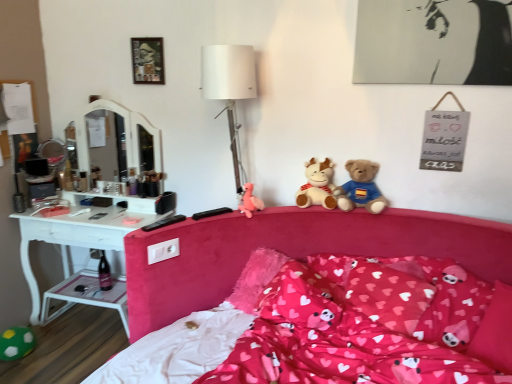
Question: Is white plastic side table at lower left turned away from soft plush teddy bear at center?

Choices:
 (A) no
 (B) yes

Answer: (A)

Question: Is white plastic side table at lower left at the right side of soft plush teddy bear at center?

Choices:
 (A) yes
 (B) no

Answer: (B)

Question: Are white plastic side table at lower left and soft plush teddy bear at center making contact?

Choices:
 (A) yes
 (B) no

Answer: (B)

Question: Is white plastic side table at lower left facing towards soft plush teddy bear at center?

Choices:
 (A) yes
 (B) no

Answer: (B)

Question: Considering the relative sizes of white plastic side table at lower left and soft plush teddy bear at center in the image provided, is white plastic side table at lower left shorter than soft plush teddy bear at center?

Choices:
 (A) no
 (B) yes

Answer: (B)

Question: Would you say soft plush teddy bear at center is part of white plastic side table at lower left's contents?

Choices:
 (A) no
 (B) yes

Answer: (A)

Question: Can you confirm if soft plush teddy bear at center is bigger than metallic silver picture frame at upper center?

Choices:
 (A) yes
 (B) no

Answer: (A)

Question: Is soft plush teddy bear at center to the right of metallic silver picture frame at upper center from the viewer's perspective?

Choices:
 (A) no
 (B) yes

Answer: (B)

Question: From the image's perspective, is soft plush teddy bear at center on metallic silver picture frame at upper center?

Choices:
 (A) no
 (B) yes

Answer: (A)

Question: Does soft plush teddy bear at center lie behind metallic silver picture frame at upper center?

Choices:
 (A) yes
 (B) no

Answer: (B)

Question: Is soft plush teddy bear at center turned away from metallic silver picture frame at upper center?

Choices:
 (A) yes
 (B) no

Answer: (B)

Question: Is metallic silver picture frame at upper center completely or partially inside soft plush teddy bear at center?

Choices:
 (A) no
 (B) yes

Answer: (A)

Question: Is velvet pink bed at center inside pink plush pillow at center, the 2th pillow in the right-to-left sequence?

Choices:
 (A) no
 (B) yes

Answer: (A)